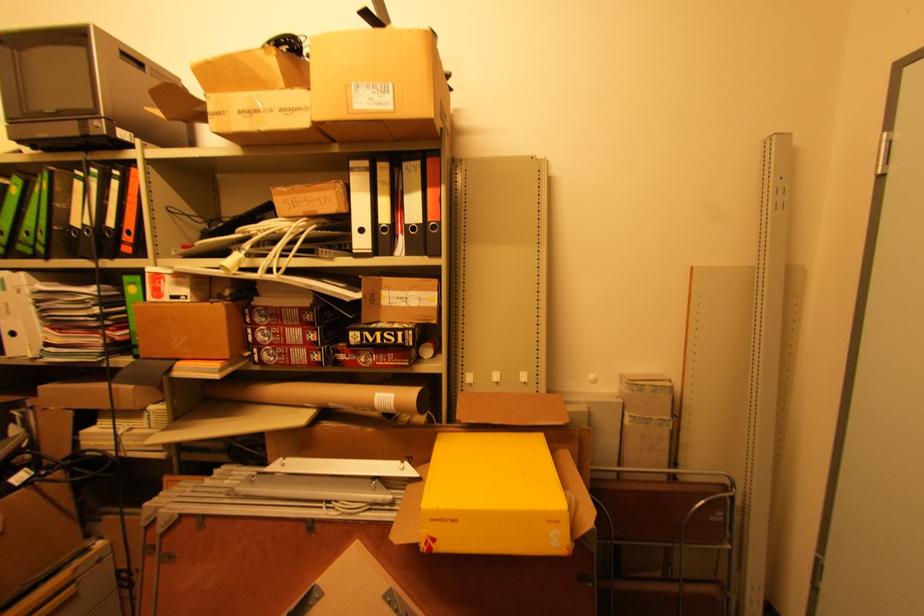
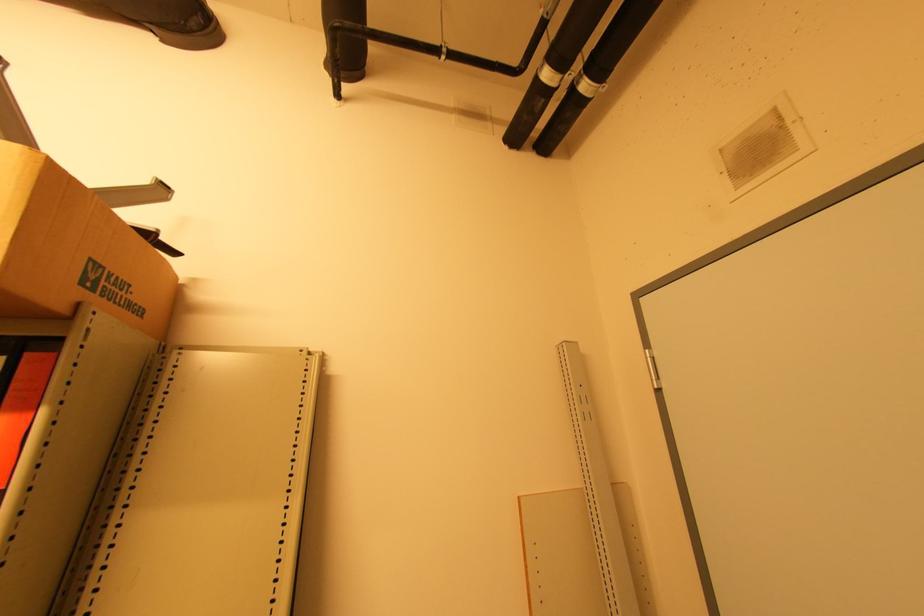
Where in the second image is the point corresponding to (444,120) from the first image?

(95, 290)